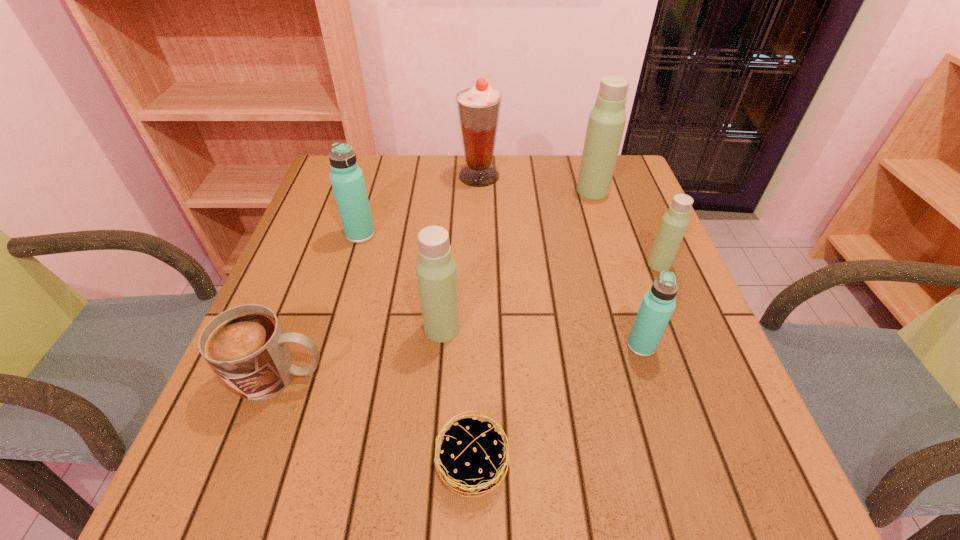
Locate an element on the screen. The width and height of the screenshot is (960, 540). free point at the left edge is located at coordinates (328, 349).

In the image, there is a desktop. Find the location of `vacant space at the right edge`. vacant space at the right edge is located at coordinates (722, 440).

The height and width of the screenshot is (540, 960). I want to click on vacant space at the far left corner of the desktop, so click(x=372, y=172).

The image size is (960, 540). In the image, there is a desktop. What are the coordinates of `vacant region at the far right corner` in the screenshot? It's located at (610, 201).

The width and height of the screenshot is (960, 540). I want to click on blank area at the near right corner, so click(x=723, y=465).

Locate an element on the screen. The width and height of the screenshot is (960, 540). free space between the smaller aqua thermos bottle and the farthest light thermos bottle is located at coordinates tap(617, 268).

I want to click on empty space between the farthest thermos bottle and the third farthest object, so click(x=476, y=213).

Image resolution: width=960 pixels, height=540 pixels. Find the location of `free space that is in between the red smoothie and the rightmost light thermos bottle`. free space that is in between the red smoothie and the rightmost light thermos bottle is located at coordinates (569, 220).

The width and height of the screenshot is (960, 540). What are the coordinates of `free space that is in between the second farthest thermos bottle and the second shortest object` in the screenshot? It's located at (321, 306).

At what (x,y) coordinates should I click in order to perform the action: click on free area in between the fourth nearest thermos bottle and the tallest thermos bottle. Please return your answer as a coordinate pair (x, y). This screenshot has width=960, height=540. Looking at the image, I should click on (476, 213).